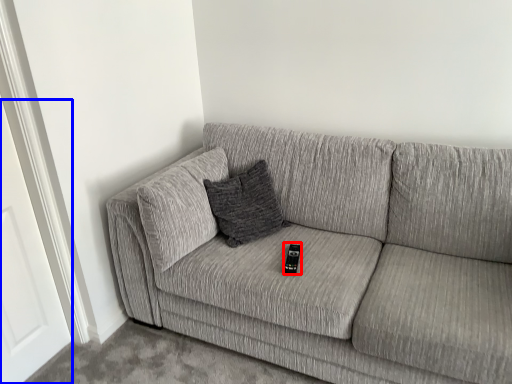
Question: Which object appears farthest to the camera in this image, remote (highlighted by a red box) or door (highlighted by a blue box)?

Choices:
 (A) remote
 (B) door

Answer: (A)